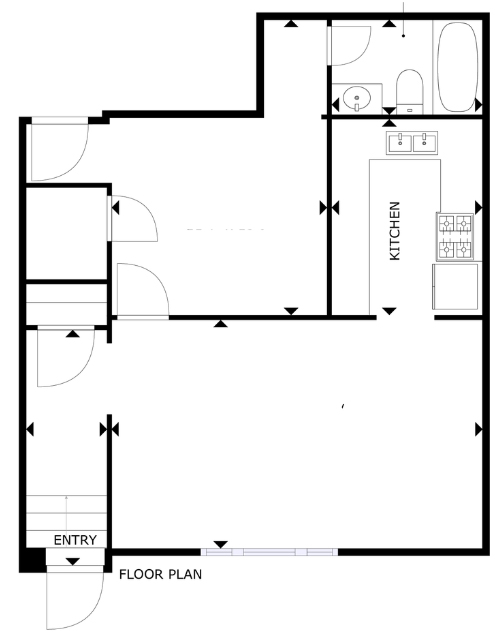
At what (x,y) coordinates should I click in order to perform the action: click on doorway. Please return your answer as a coordinate pair (x, y). The width and height of the screenshot is (500, 642). Looking at the image, I should click on (63, 557), (64, 325), (145, 314), (108, 230), (329, 40), (56, 123).